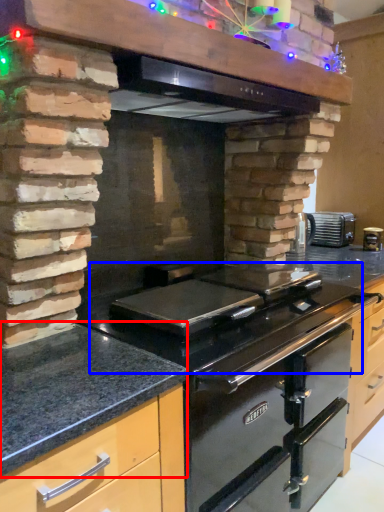
Question: Which point is closer to the camera, countertop (highlighted by a red box) or gas stove (highlighted by a blue box)?

Choices:
 (A) countertop
 (B) gas stove

Answer: (A)